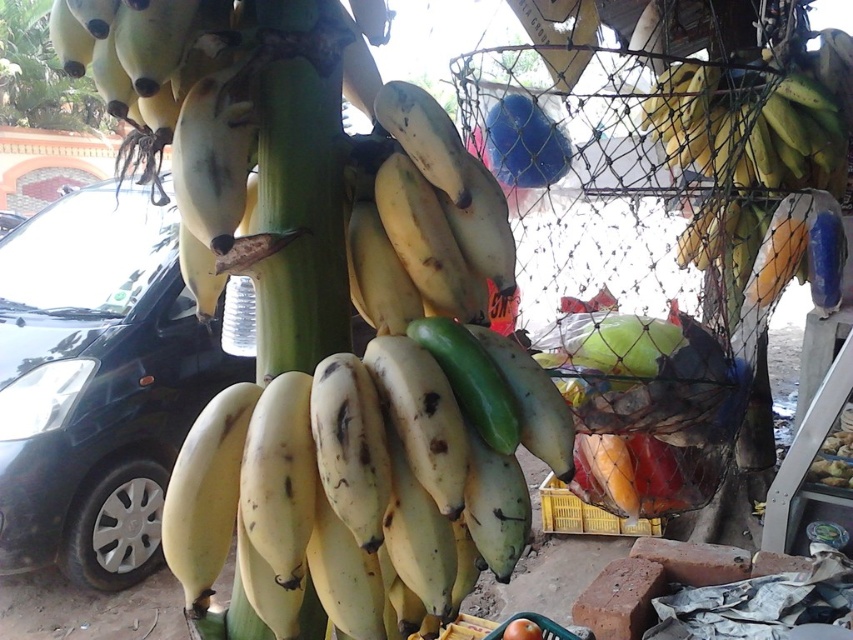
This screenshot has width=853, height=640. What do you see at coordinates (376, 410) in the screenshot?
I see `yellow matte bananas at center` at bounding box center [376, 410].

Between point (350, 556) and point (178, 266), which one is positioned in front?

Positioned in front is point (350, 556).

Between point (347, 362) and point (33, 326), which one is positioned in front?

Point (347, 362) is in front.

Locate an element on the screen. Image resolution: width=853 pixels, height=640 pixels. yellow matte bananas at center is located at coordinates (376, 410).

Is yellow matte bananas at center in front of green matte bananas at upper right?

Yes, yellow matte bananas at center is in front of green matte bananas at upper right.

Who is higher up, yellow matte bananas at center or green matte bananas at upper right?

green matte bananas at upper right is higher up.

The height and width of the screenshot is (640, 853). What do you see at coordinates (376, 410) in the screenshot? I see `yellow matte bananas at center` at bounding box center [376, 410].

Find the location of `yellow matte bananas at center`. yellow matte bananas at center is located at coordinates (376, 410).

Does black metallic car at left appear on the left side of green matte bananas at upper right?

Correct, you'll find black metallic car at left to the left of green matte bananas at upper right.

Which of these two, black metallic car at left or green matte bananas at upper right, stands shorter?

green matte bananas at upper right

Between point (199, 371) and point (822, 65), which one is positioned in front?

Point (822, 65) is in front.

Where is `black metallic car at left`? This screenshot has height=640, width=853. black metallic car at left is located at coordinates (97, 384).